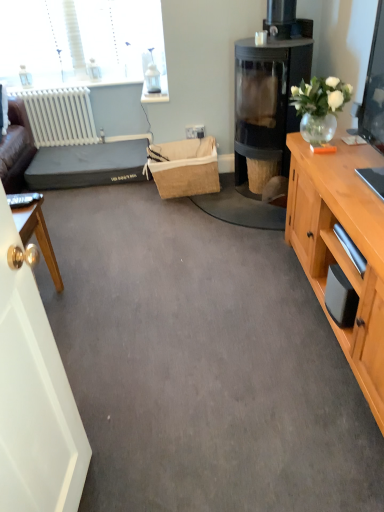
Question: From the image's perspective, is wooden drawer at right positioned above or below polished wood desk at left?

Choices:
 (A) below
 (B) above

Answer: (B)

Question: Based on their positions, is wooden drawer at right located to the left or right of polished wood desk at left?

Choices:
 (A) right
 (B) left

Answer: (A)

Question: Estimate the real-world distances between objects in this image. Which object is farther from the dark gray fabric dog bed at left?

Choices:
 (A) transparent glass fireplace at upper right
 (B) clear glass vase at upper right
 (C) white matte radiator at left
 (D) polished wood desk at left
 (E) white glossy door at left

Answer: (E)

Question: Based on their relative distances, which object is nearer to the polished wood desk at left?

Choices:
 (A) transparent glass fireplace at upper right
 (B) white matte radiator at left
 (C) white glossy door at left
 (D) dark gray fabric dog bed at left
 (E) wooden drawer at right

Answer: (C)